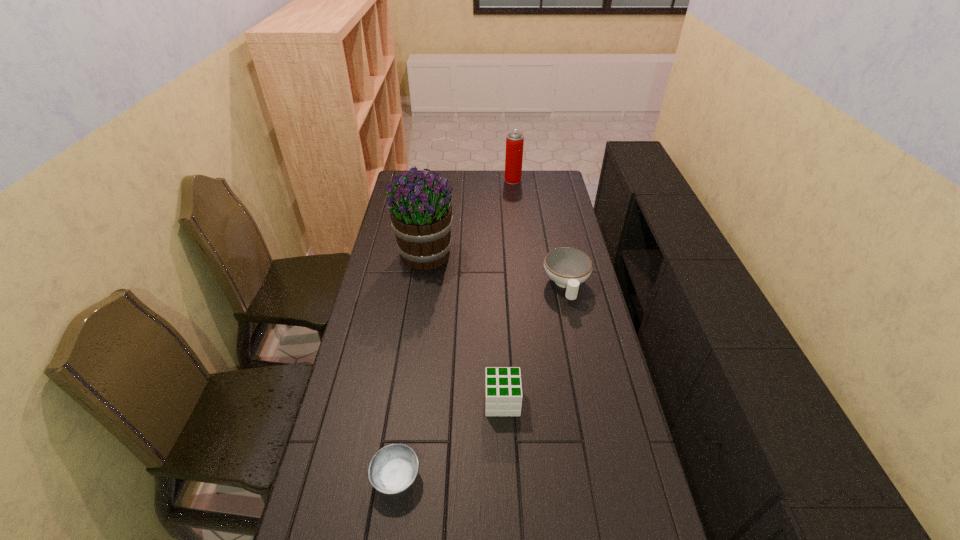
Image resolution: width=960 pixels, height=540 pixels. In order to click on free space that is in between the cube and the bouquet in this screenshot , I will do `click(464, 328)`.

In order to click on free space between the fourth object from left to right and the shortest object in this screenshot , I will do `click(455, 329)`.

At what (x,y) coordinates should I click in order to perform the action: click on free space between the cube and the farthest object. Please return your answer as a coordinate pair (x, y). The width and height of the screenshot is (960, 540). Looking at the image, I should click on [x=508, y=291].

Select which object appears as the fourth closest to the ashtray. Please provide its 2D coordinates. Your answer should be formatted as a tuple, i.e. [(x, y)], where the tuple contains the x and y coordinates of a point satisfying the conditions above.

[(514, 141)]

Locate an element on the screen. The width and height of the screenshot is (960, 540). object that is the third closest one to the tallest object is located at coordinates (503, 390).